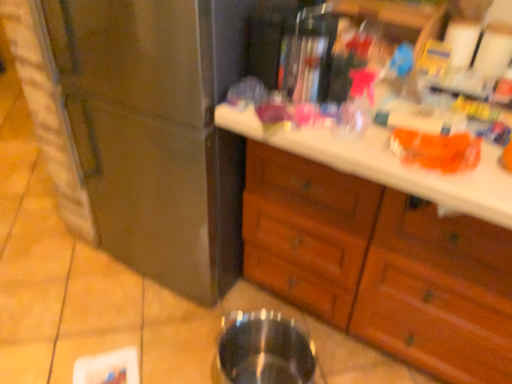
Question: In terms of width, does stainless steel refrigerator at left look wider or thinner when compared to wooden drawers at center?

Choices:
 (A) wide
 (B) thin

Answer: (A)

Question: From their relative heights in the image, would you say stainless steel refrigerator at left is taller or shorter than wooden drawers at center?

Choices:
 (A) tall
 (B) short

Answer: (A)

Question: Estimate the real-world distances between objects in this image. Which object is closer to the transparent glass at lower center?

Choices:
 (A) stainless steel refrigerator at left
 (B) wooden drawers at center

Answer: (B)

Question: Which of these objects is positioned closest to the stainless steel refrigerator at left?

Choices:
 (A) transparent glass at lower center
 (B) wooden drawers at center

Answer: (B)